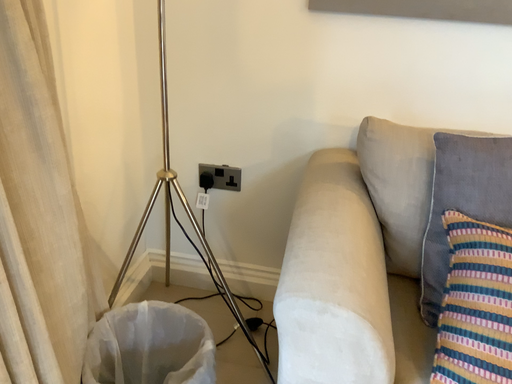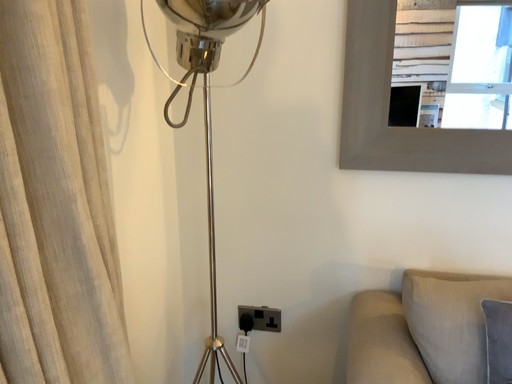
Question: Which way did the camera rotate in the video?

Choices:
 (A) rotated downward
 (B) rotated upward

Answer: (B)